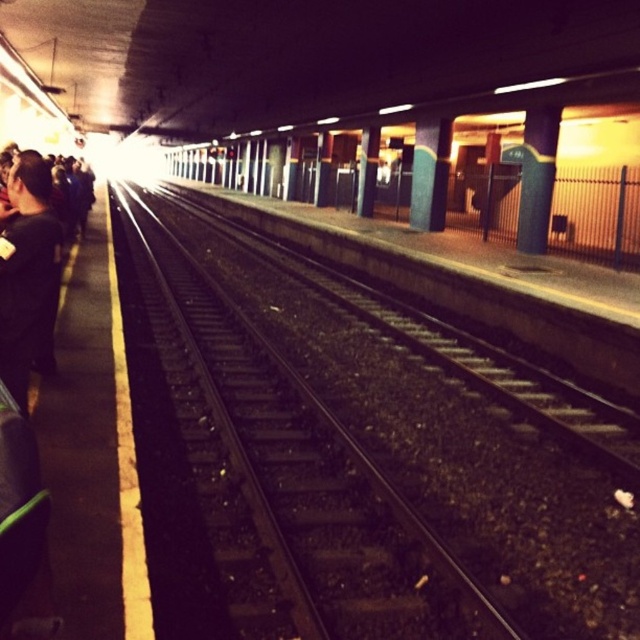
Is the position of black metal track at center less distant than that of smooth concrete pillar at right?

Yes.

Who is shorter, black metal track at center or smooth concrete pillar at right?

Standing shorter between the two is smooth concrete pillar at right.

Does point (202, 296) come closer to viewer compared to point (531, 237)?

Yes, point (202, 296) is in front of point (531, 237).

Locate an element on the screen. The width and height of the screenshot is (640, 640). black metal track at center is located at coordinates (385, 461).

Is black metal track at center bigger than black matte jacket at left?

Indeed, black metal track at center has a larger size compared to black matte jacket at left.

Looking at this image, is black metal track at center below black matte jacket at left?

Correct, black metal track at center is located below black matte jacket at left.

The width and height of the screenshot is (640, 640). What do you see at coordinates (385, 461) in the screenshot?
I see `black metal track at center` at bounding box center [385, 461].

Find the location of a particular element. The width and height of the screenshot is (640, 640). black metal track at center is located at coordinates (385, 461).

Who is lower down, black matte jacket at left or smooth concrete pillar at right?

black matte jacket at left

Does black matte jacket at left lie behind smooth concrete pillar at right?

No.

The height and width of the screenshot is (640, 640). I want to click on black matte jacket at left, so tap(24, 268).

At what (x,y) coordinates should I click in order to perform the action: click on black matte jacket at left. Please return your answer as a coordinate pair (x, y). Looking at the image, I should click on (24, 268).